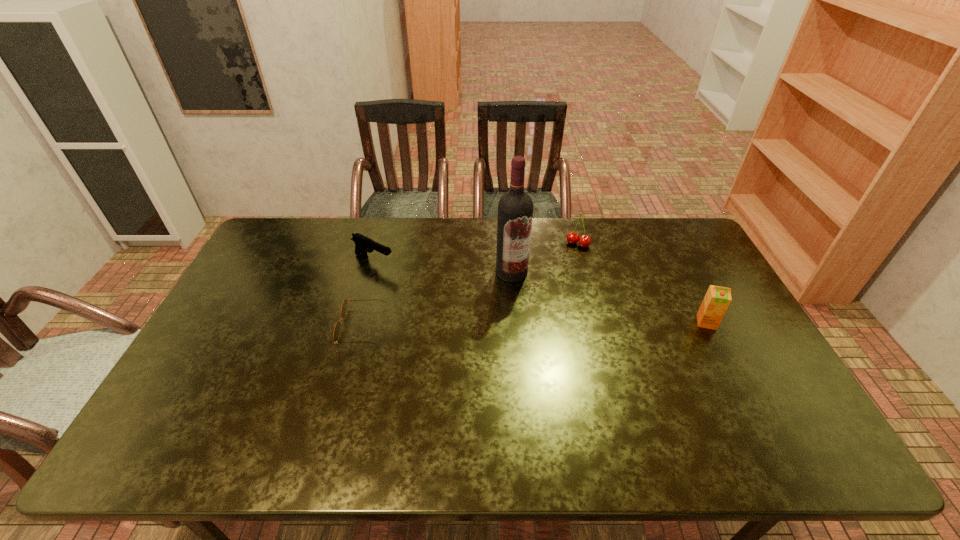
Where is `sunglasses`? sunglasses is located at coordinates (337, 328).

You are a GUI agent. You are given a task and a screenshot of the screen. Output one action in this format:
    pyautogui.click(x=<x>, y=<y>)
    Task: Click on the orange juice
    Image resolution: width=960 pixels, height=540 pixels.
    Given the screenshot: What is the action you would take?
    pyautogui.click(x=717, y=299)

The width and height of the screenshot is (960, 540). I want to click on the second tallest object, so click(717, 299).

Locate an element on the screen. This screenshot has height=540, width=960. the second shortest object is located at coordinates pos(363,244).

Locate an element on the screen. The width and height of the screenshot is (960, 540). cherry is located at coordinates (584, 241).

The image size is (960, 540). What are the coordinates of `the second object from right to left` in the screenshot? It's located at (584, 241).

Find the location of a particular element. The image size is (960, 540). the third object from right to left is located at coordinates (515, 208).

Where is `wine bottle`? The image size is (960, 540). wine bottle is located at coordinates (515, 208).

The height and width of the screenshot is (540, 960). I want to click on vacant space situated 0.340m on the face of the shortest object, so click(226, 326).

Where is `free space located on the face of the shortest object`? The image size is (960, 540). free space located on the face of the shortest object is located at coordinates (284, 326).